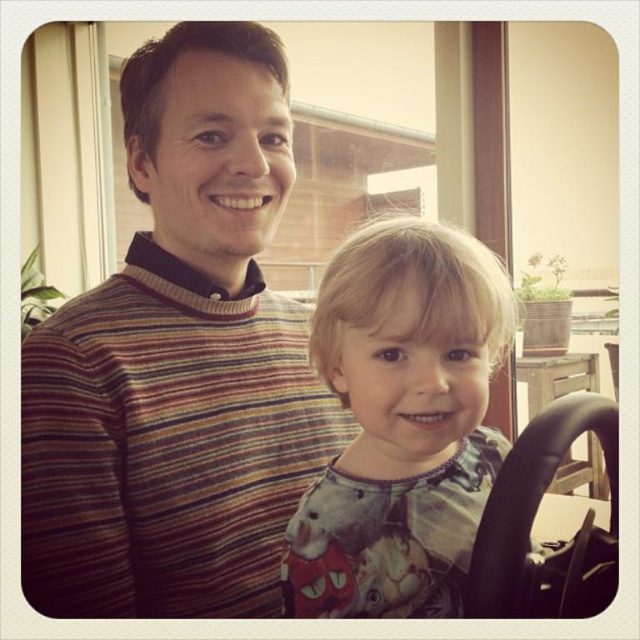
You are standing in the room and want to place a small plant between the two points, point (312, 451) and point (365, 605). Which point should the plant be closer to in order to be closer to the viewer?

The plant should be closer to point (312, 451) because it is further to the viewer than point (365, 605).

You are holding a 60 cm long ruler and want to measure the distance from your position to the point at coordinates [193,396]. Can you reach it with the ruler?

The point at coordinates [193,396] is 68.66 centimeters away from the camera. Since the ruler is only 60 cm long, you cannot reach it with the ruler.

You are a tailor measuring clothing for customers. You have a striped sweater at left and a printed cotton shirt at center. Which garment has a greater width measurement?

The striped sweater at left has a greater width measurement than the printed cotton shirt at center.